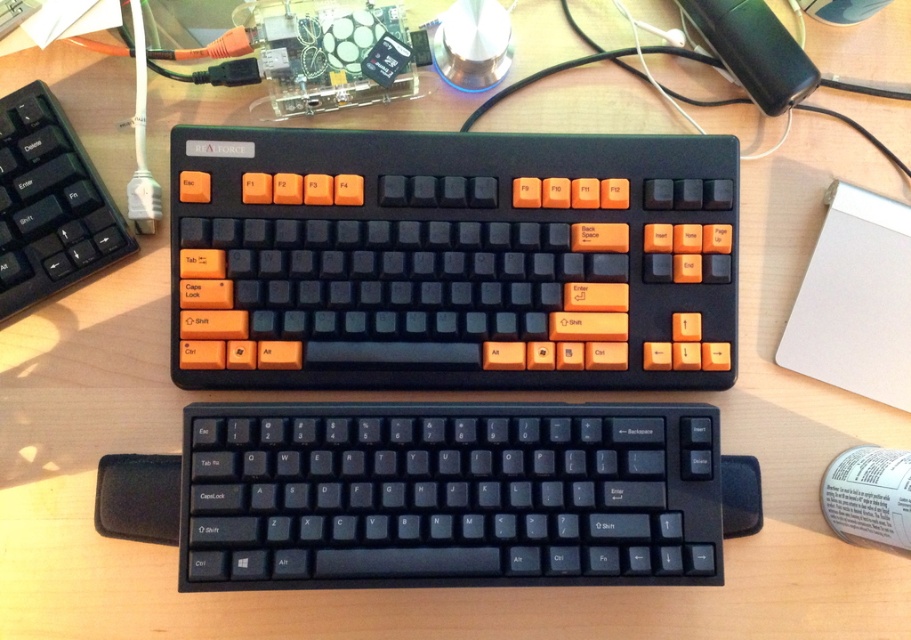
Question: Based on their relative distances, which object is nearer to the matte black keyboard at center?

Choices:
 (A) matte black keyboard at left
 (B) black plastic keyboard at center

Answer: (B)

Question: Is black plastic keyboard at center above matte black keyboard at left?

Choices:
 (A) yes
 (B) no

Answer: (B)

Question: Which point is farther from the camera taking this photo?

Choices:
 (A) pyautogui.click(x=556, y=320)
 (B) pyautogui.click(x=247, y=509)

Answer: (A)

Question: Can you confirm if matte black keyboard at center is wider than matte black keyboard at left?

Choices:
 (A) yes
 (B) no

Answer: (A)

Question: Among these points, which one is nearest to the camera?

Choices:
 (A) (280, 509)
 (B) (84, 269)

Answer: (A)

Question: Can you confirm if matte black keyboard at center is positioned to the right of matte black keyboard at left?

Choices:
 (A) no
 (B) yes

Answer: (B)